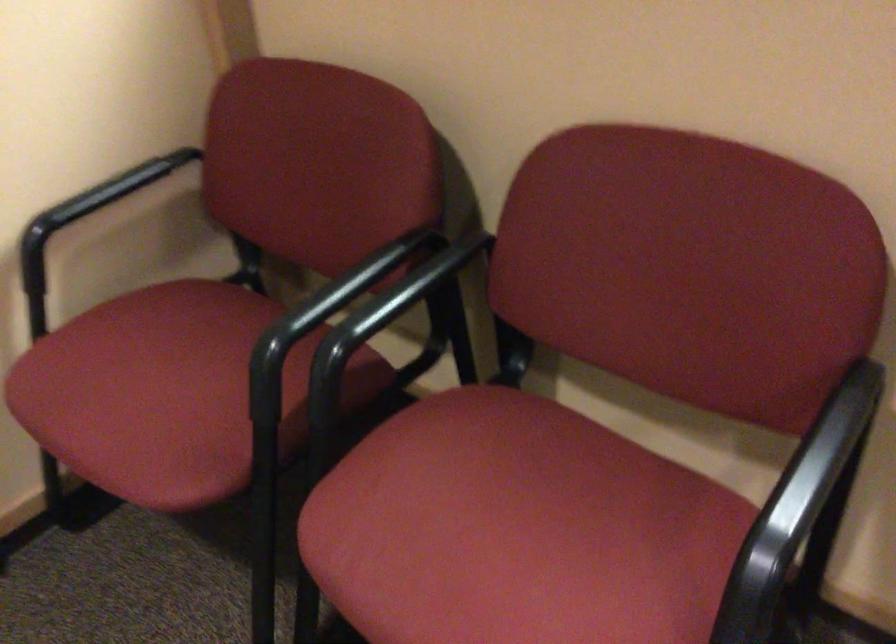
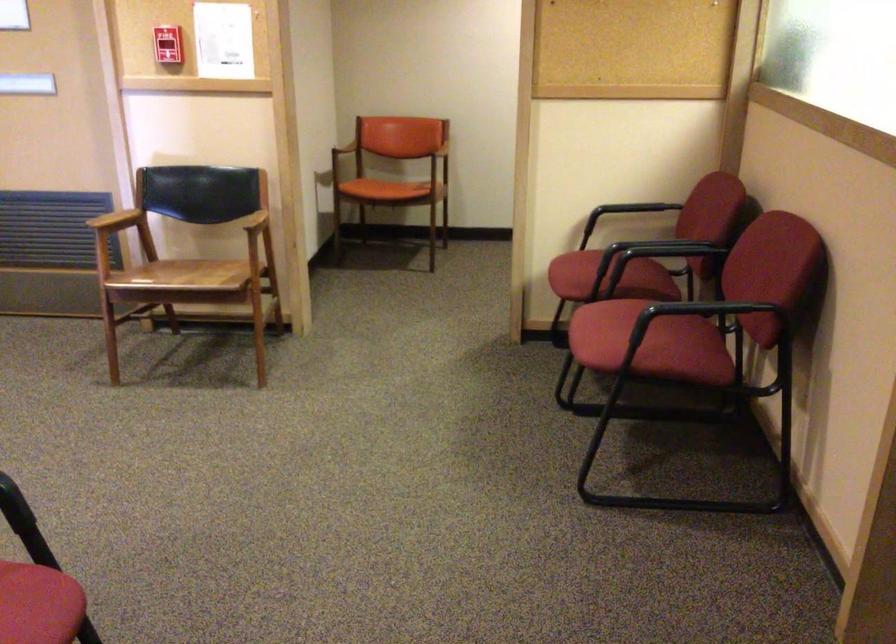
Locate, in the second image, the point that corresponds to (115,214) in the first image.

(625, 211)